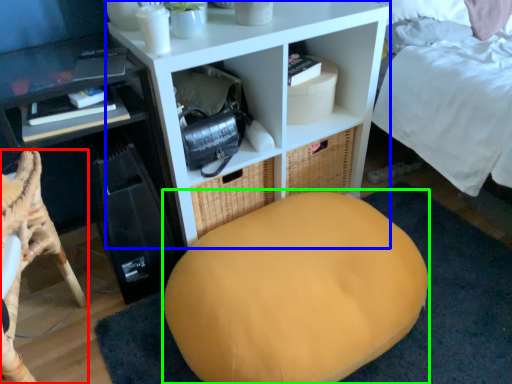
Question: Estimate the real-world distances between objects in this image. Which object is farther from furniture (highlighted by a red box), shelf (highlighted by a blue box) or bean bag chair (highlighted by a green box)?

Choices:
 (A) shelf
 (B) bean bag chair

Answer: (A)